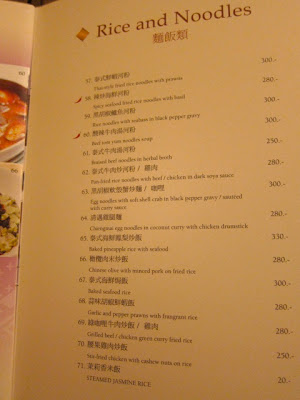
The image size is (300, 400). I want to click on bowl, so click(22, 148), click(18, 175).